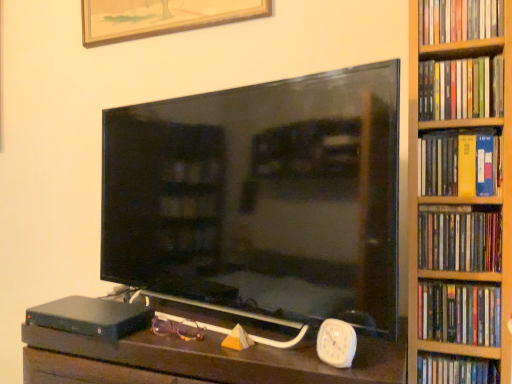
Question: Is purple plastic glasses at center turned away from black matte hardcover at lower left?

Choices:
 (A) yes
 (B) no

Answer: (B)

Question: Considering the relative sizes of purple plastic glasses at center and black matte hardcover at lower left in the image provided, is purple plastic glasses at center taller than black matte hardcover at lower left?

Choices:
 (A) yes
 (B) no

Answer: (B)

Question: Is purple plastic glasses at center at the left side of black matte hardcover at lower left?

Choices:
 (A) yes
 (B) no

Answer: (B)

Question: Can you confirm if purple plastic glasses at center is smaller than black matte hardcover at lower left?

Choices:
 (A) yes
 (B) no

Answer: (A)

Question: Can you confirm if purple plastic glasses at center is thinner than black matte hardcover at lower left?

Choices:
 (A) no
 (B) yes

Answer: (B)

Question: In terms of width, does hardcover book at right, the fourth book from the top, look wider or thinner when compared to black matte hardcover at lower left?

Choices:
 (A) thin
 (B) wide

Answer: (A)

Question: Is point (440, 254) positioned closer to the camera than point (141, 324)?

Choices:
 (A) closer
 (B) farther

Answer: (A)

Question: From a real-world perspective, is hardcover book at right, placed as the 3th book when sorted from bottom to top, above or below black matte hardcover at lower left?

Choices:
 (A) above
 (B) below

Answer: (A)

Question: Is hardcover book at right, the fourth book from the top, in front of or behind black matte hardcover at lower left in the image?

Choices:
 (A) front
 (B) behind

Answer: (A)

Question: Choose the correct answer: Is hardcover book at right, the second book from the top, inside hardcover book at right, which is the 6th book from bottom to top, or outside it?

Choices:
 (A) outside
 (B) inside

Answer: (A)

Question: From the image's perspective, is hardcover book at right, the 5th book positioned from the bottom, above or below hardcover book at right, which is the 6th book from bottom to top?

Choices:
 (A) above
 (B) below

Answer: (B)

Question: Relative to hardcover book at right, which is the 6th book from bottom to top, is hardcover book at right, the second book from the top, in front or behind?

Choices:
 (A) behind
 (B) front

Answer: (A)

Question: From their relative heights in the image, would you say hardcover book at right, the second book from the top, is taller or shorter than hardcover book at right, which is the 6th book from bottom to top?

Choices:
 (A) tall
 (B) short

Answer: (B)

Question: In terms of height, does black matte hardcover at lower left look taller or shorter compared to purple plastic glasses at center?

Choices:
 (A) tall
 (B) short

Answer: (A)

Question: In terms of width, does black matte hardcover at lower left look wider or thinner when compared to purple plastic glasses at center?

Choices:
 (A) thin
 (B) wide

Answer: (B)